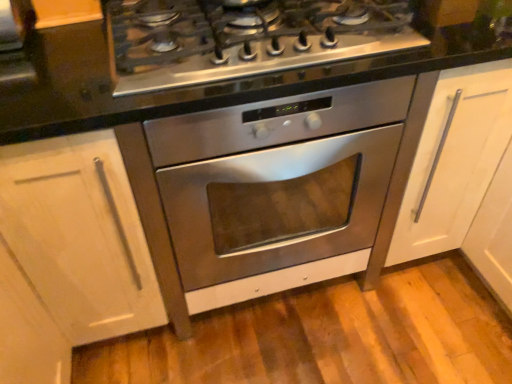
What do you see at coordinates (227, 56) in the screenshot? I see `stainless steel cooktop at center` at bounding box center [227, 56].

The image size is (512, 384). I want to click on stainless steel cooktop at center, so click(x=227, y=56).

In order to face stainless steel oven at center, should I rotate leftwards or rightwards?

You should rotate right by 1.131 degrees.

This screenshot has width=512, height=384. What do you see at coordinates (277, 179) in the screenshot? I see `stainless steel oven at center` at bounding box center [277, 179].

Where is `stainless steel oven at center`? stainless steel oven at center is located at coordinates (277, 179).

In order to click on stainless steel cooktop at center in this screenshot , I will do `click(227, 56)`.

Is stainless steel oven at center at the right side of stainless steel cooktop at center?

Yes, stainless steel oven at center is to the right of stainless steel cooktop at center.

Is stainless steel oven at center positioned behind stainless steel cooktop at center?

Yes, the depth of stainless steel oven at center is greater than that of stainless steel cooktop at center.

Considering the points (187, 220) and (65, 66), which point is behind, point (187, 220) or point (65, 66)?

The point (65, 66) is farther.

From the image's perspective, would you say stainless steel oven at center is shown under stainless steel cooktop at center?

Yes, from the image's perspective, stainless steel oven at center is below stainless steel cooktop at center.

Based on the photo, from a real-world perspective, relative to stainless steel cooktop at center, is stainless steel oven at center vertically above or below?

stainless steel oven at center is situated lower than stainless steel cooktop at center in the real world.

Can you confirm if stainless steel oven at center is thinner than stainless steel cooktop at center?

No, stainless steel oven at center is not thinner than stainless steel cooktop at center.

Can you confirm if stainless steel oven at center is shorter than stainless steel cooktop at center?

In fact, stainless steel oven at center may be taller than stainless steel cooktop at center.

Can you confirm if stainless steel oven at center is smaller than stainless steel cooktop at center?

No.

Would you say stainless steel oven at center is inside or outside stainless steel cooktop at center?

stainless steel oven at center is not enclosed by stainless steel cooktop at center.

Can you see stainless steel oven at center touching stainless steel cooktop at center?

stainless steel oven at center and stainless steel cooktop at center are not in contact.

Is stainless steel oven at center facing away from stainless steel cooktop at center?

No, stainless steel cooktop at center is not at the back of stainless steel oven at center.

How many degrees apart are the facing directions of stainless steel oven at center and stainless steel cooktop at center?

The angular difference between stainless steel oven at center and stainless steel cooktop at center is 0.845 degrees.

In the image, there is a stainless steel oven at center. What are the coordinates of `counter top above it (from the image's perspective)` in the screenshot? It's located at 227,56.

Based on their positions, is stainless steel cooktop at center located to the left or right of stainless steel oven at center?

stainless steel cooktop at center is positioned on stainless steel oven at center's left side.

Which object is further away from the camera, stainless steel cooktop at center or stainless steel oven at center?

stainless steel oven at center is further away from the camera.

Is point (72, 126) farther from camera compared to point (358, 100)?

No, it is in front of (358, 100).

From the image's perspective, is stainless steel cooktop at center on stainless steel oven at center?

Yes.

From a real-world perspective, is stainless steel cooktop at center physically below stainless steel oven at center?

Actually, stainless steel cooktop at center is physically above stainless steel oven at center in the real world.

Is stainless steel cooktop at center wider or thinner than stainless steel oven at center?

Clearly, stainless steel cooktop at center has less width compared to stainless steel oven at center.

Between stainless steel cooktop at center and stainless steel oven at center, which one has more height?

With more height is stainless steel oven at center.

Is stainless steel cooktop at center bigger than stainless steel oven at center?

No, stainless steel cooktop at center is not bigger than stainless steel oven at center.

Choose the correct answer: Is stainless steel cooktop at center inside stainless steel oven at center or outside it?

stainless steel cooktop at center is spatially situated outside stainless steel oven at center.

Is stainless steel cooktop at center not near stainless steel oven at center?

No, stainless steel cooktop at center is in close proximity to stainless steel oven at center.

Could you tell me if stainless steel cooktop at center is turned towards stainless steel oven at center?

No.

Based on the photo, measure the distance between stainless steel cooktop at center and stainless steel oven at center.

stainless steel cooktop at center and stainless steel oven at center are 11.10 inches apart.

At what (x,y) coordinates should I click in order to perform the action: click on counter top on the left of stainless steel oven at center. Please return your answer as a coordinate pair (x, y). Looking at the image, I should click on (227, 56).

Where is `oven located below the stainless steel cooktop at center (from the image's perspective)`? Image resolution: width=512 pixels, height=384 pixels. oven located below the stainless steel cooktop at center (from the image's perspective) is located at coordinates (277, 179).

This screenshot has width=512, height=384. What are the coordinates of `counter top in front of the stainless steel oven at center` in the screenshot? It's located at (227, 56).